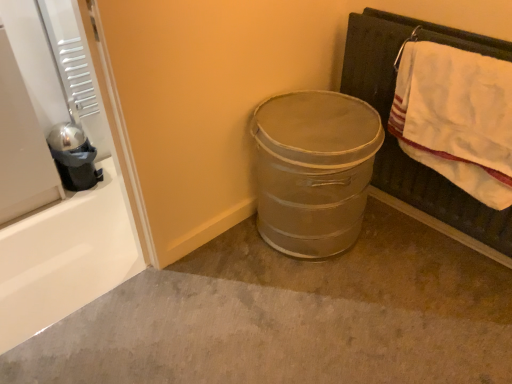
This screenshot has width=512, height=384. What are the coordinates of `metallic gray trash can at center` in the screenshot? It's located at point(313,170).

Measure the distance between metallic gray trash can at center and camera.

A distance of 4.56 feet exists between metallic gray trash can at center and camera.

The height and width of the screenshot is (384, 512). What do you see at coordinates (291, 316) in the screenshot?
I see `metallic gray trash can at center` at bounding box center [291, 316].

Identify the location of white cotton towel at upper right. (456, 117).

You are a GUI agent. You are given a task and a screenshot of the screen. Output one action in this format:
    pyautogui.click(x=<x>, y=<y>)
    Task: Click on the metallic gray trash can at center
    Image resolution: width=512 pixels, height=384 pixels.
    Given the screenshot: What is the action you would take?
    pyautogui.click(x=313, y=170)

Is metallic gray trash can at center positioned with its back to white cotton towel at upper right?

metallic gray trash can at center does not have its back to white cotton towel at upper right.

You are a GUI agent. You are given a task and a screenshot of the screen. Output one action in this format:
    pyautogui.click(x=<x>, y=<y>)
    Task: Click on the bath towel above the metallic gray trash can at center (from a real-world perspective)
    The width and height of the screenshot is (512, 384).
    Given the screenshot: What is the action you would take?
    pyautogui.click(x=456, y=117)

Which of these two, metallic gray trash can at center or white cotton towel at upper right, stands shorter?

With less height is metallic gray trash can at center.

Would you say metallic gray trash can at center is to the left or to the right of white cotton towel at upper right in the picture?

In the image, metallic gray trash can at center appears on the left side of white cotton towel at upper right.

Could white cotton towel at upper right be considered to be inside metallic gray trash can at center?

No, white cotton towel at upper right is not inside metallic gray trash can at center.

Considering the sizes of objects metallic gray trash can at center and white cotton towel at upper right in the image provided, who is wider, metallic gray trash can at center or white cotton towel at upper right?

With larger width is metallic gray trash can at center.

Considering the sizes of objects metallic gray trash can at center and white cotton towel at upper right in the image provided, who is taller, metallic gray trash can at center or white cotton towel at upper right?

Standing taller between the two is metallic gray trash can at center.

Could you tell me if metallic gray trash can at center is turned towards white cotton towel at upper right?

Yes, metallic gray trash can at center is oriented towards white cotton towel at upper right.

From a real-world perspective, which object rests below the other?

metallic gray trash can at center, from a real-world perspective.

Can we say white cotton towel at upper right lies outside metallic gray trash can at center?

Yes, white cotton towel at upper right is not within metallic gray trash can at center.

Which of these two, white cotton towel at upper right or metallic gray trash can at center, is bigger?

Bigger between the two is metallic gray trash can at center.

Can you confirm if white cotton towel at upper right is shorter than metallic gray trash can at center?

Correct, white cotton towel at upper right is not as tall as metallic gray trash can at center.

From a real-world perspective, who is located higher, shiny metallic pot at left or metallic gray trash can at center?

In real-world perspective, shiny metallic pot at left is above.

Would you say shiny metallic pot at left is inside or outside metallic gray trash can at center?

shiny metallic pot at left lies outside metallic gray trash can at center.

Between point (73, 160) and point (368, 237), which one is positioned in front?

The point (368, 237) is closer.

Based on the photo, is shiny metallic pot at left at the right side of metallic gray trash can at center?

No.

Is metallic gray trash can at center facing towards shiny metallic pot at left?

No, metallic gray trash can at center is not turned towards shiny metallic pot at left.

Can you confirm if metallic gray trash can at center is positioned to the left of shiny metallic pot at left?

No.

Is metallic gray trash can at center not inside shiny metallic pot at left?

That's correct, metallic gray trash can at center is outside of shiny metallic pot at left.

From a real-world perspective, is metallic gray trash can at center below shiny metallic pot at left?

Indeed, from a real-world perspective, metallic gray trash can at center is positioned beneath shiny metallic pot at left.

Can we say shiny metallic pot at left lies outside metallic gray trash can at center?

Yes, shiny metallic pot at left is outside of metallic gray trash can at center.

Does shiny metallic pot at left touch metallic gray trash can at center?

There is a gap between shiny metallic pot at left and metallic gray trash can at center.

The width and height of the screenshot is (512, 384). Find the location of `trash bin/can that appears above the shiny metallic pot at left (from a real-world perspective)`. trash bin/can that appears above the shiny metallic pot at left (from a real-world perspective) is located at coordinates (313, 170).

Is shiny metallic pot at left oriented towards metallic gray trash can at center?

No, shiny metallic pot at left is not turned towards metallic gray trash can at center.

In the scene shown: Is white cotton towel at upper right positioned beyond the bounds of shiny metallic pot at left?

Indeed, white cotton towel at upper right is completely outside shiny metallic pot at left.

From the picture: Is the position of white cotton towel at upper right less distant than that of shiny metallic pot at left?

Yes, the depth of white cotton towel at upper right is less than that of shiny metallic pot at left.

Between white cotton towel at upper right and shiny metallic pot at left, which one has smaller width?

Thinner between the two is white cotton towel at upper right.

The image size is (512, 384). Identify the location of concrete on the left of white cotton towel at upper right. (291, 316).

Identify the location of trash bin/can below the white cotton towel at upper right (from a real-world perspective). (313, 170).

Which object lies nearer to the anchor point white cotton towel at upper right, metallic gray trash can at center or shiny metallic pot at left?

metallic gray trash can at center lies closer to white cotton towel at upper right than the other object.

From the image, which object appears to be farther from metallic gray trash can at center, shiny metallic pot at left or white cotton towel at upper right?

The object further to metallic gray trash can at center is shiny metallic pot at left.

From the image, which object appears to be nearer to white cotton towel at upper right, metallic gray trash can at center or metallic gray trash can at center?

metallic gray trash can at center is positioned closer to the anchor white cotton towel at upper right.

Looking at the image, which one is located closer to metallic gray trash can at center, metallic gray trash can at center or white cotton towel at upper right?

Among the two, white cotton towel at upper right is located nearer to metallic gray trash can at center.

Looking at the image, which one is located closer to shiny metallic pot at left, metallic gray trash can at center or metallic gray trash can at center?

Among the two, metallic gray trash can at center is located nearer to shiny metallic pot at left.

From the image, which object appears to be nearer to shiny metallic pot at left, metallic gray trash can at center or metallic gray trash can at center?

metallic gray trash can at center lies closer to shiny metallic pot at left than the other object.

Looking at the image, which one is located closer to metallic gray trash can at center, metallic gray trash can at center or shiny metallic pot at left?

The object closer to metallic gray trash can at center is metallic gray trash can at center.

Based on their spatial positions, is shiny metallic pot at left or metallic gray trash can at center further from white cotton towel at upper right?

shiny metallic pot at left.

In order to click on trash bin/can between white cotton towel at upper right and metallic gray trash can at center from top to bottom in this screenshot , I will do `click(313, 170)`.

Identify the location of concrete between shiny metallic pot at left and white cotton towel at upper right. (291, 316).

The image size is (512, 384). Identify the location of trash bin/can between shiny metallic pot at left and white cotton towel at upper right in the horizontal direction. (313, 170).

Locate an element on the screen. This screenshot has height=384, width=512. concrete between shiny metallic pot at left and metallic gray trash can at center in the horizontal direction is located at coordinates (291, 316).